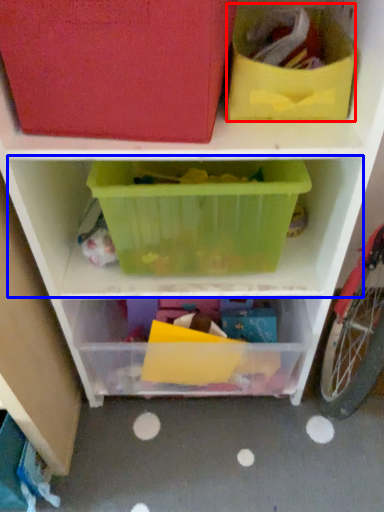
Question: Which object is closer to the camera taking this photo, storage box (highlighted by a red box) or shelf (highlighted by a blue box)?

Choices:
 (A) storage box
 (B) shelf

Answer: (A)